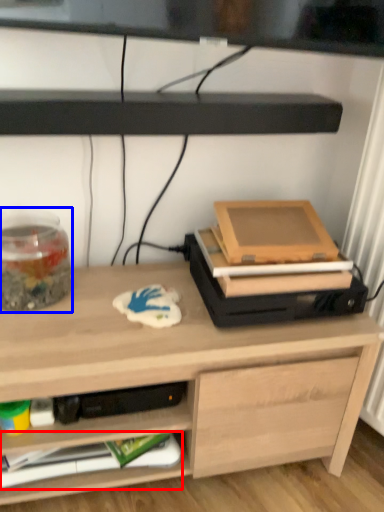
Question: Which object is closer to the camera taking this photo, paperback book (highlighted by a red box) or glass jar (highlighted by a blue box)?

Choices:
 (A) paperback book
 (B) glass jar

Answer: (B)